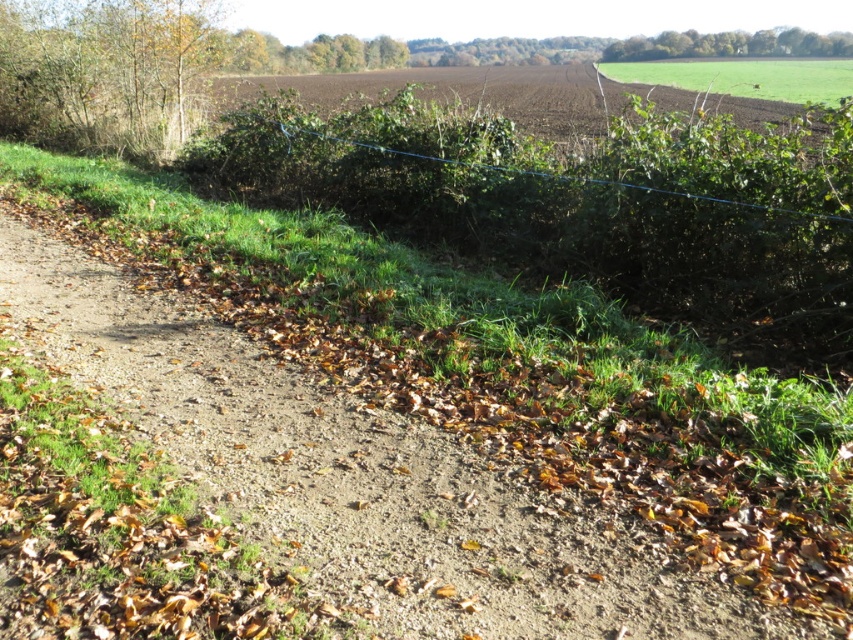
You are a hiker who wants to walk from the brown gravel trail at lower left to the green grassy field at upper right. Can you directly walk from the trail to the field without crossing any obstacles?

The brown gravel trail at lower left is positioned under green grassy field at upper right, so there is no direct path between them. You would need to navigate around any obstacles or find a clear route connecting the two areas.

You are standing on the dirt path in the rural scene. You notice two points marked on the path. One is at coordinates point (608, 634) and the other is at point (677, 65). Which point is nearer to you?

Point (608, 634) is closer to the viewer than point (677, 65).

You are standing at the point marked by point (347, 474) which is on the brown gravel trail at lower left. You want to walk towards the green grass area. Which direction should you turn to reach it?

The green grass is on one side of the brown gravel trail at lower left. Since the path is bordered by grass on one side and a dense hedge on the other, turning towards the grass side would lead you to the green grass area.